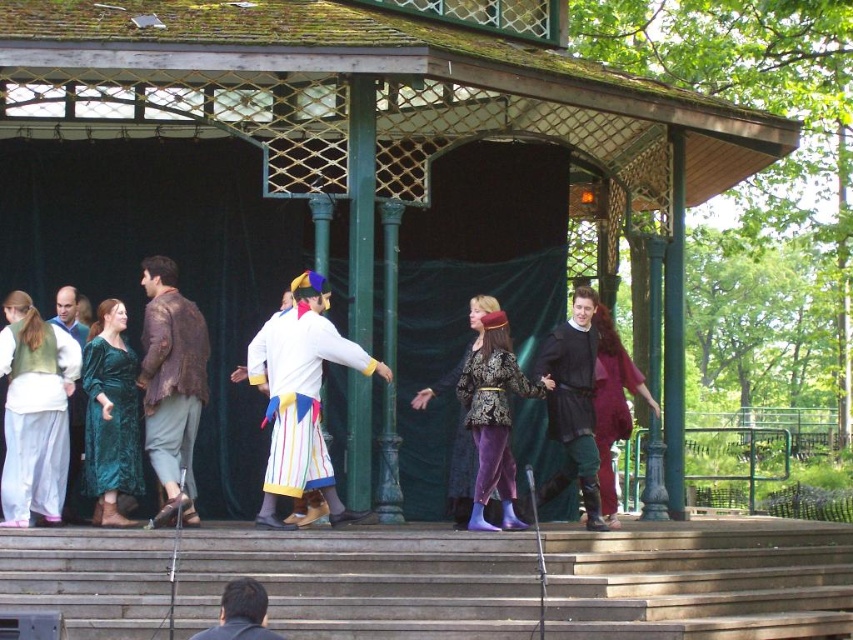
Question: Observing the image, what is the correct spatial positioning of white striped skirt at center in reference to white cotton shirt at left?

Choices:
 (A) below
 (B) above

Answer: (A)

Question: Which of the following is the farthest from the observer?

Choices:
 (A) (78, 339)
 (B) (631, 365)
 (C) (433, 563)

Answer: (B)

Question: Which point appears closest to the camera in this image?

Choices:
 (A) (573, 424)
 (B) (88, 440)
 (C) (68, 468)
 (D) (358, 365)

Answer: (D)

Question: Does dark brown leather boots at center appear over white cotton shirt at left?

Choices:
 (A) no
 (B) yes

Answer: (A)

Question: Estimate the real-world distances between objects in this image. Which object is farther from the velvet green vest at left?

Choices:
 (A) velvet/black brocade dress at center
 (B) dark brown leather jacket at lower center

Answer: (B)

Question: Does brown textured jacket at center have a greater width compared to white striped skirt at center?

Choices:
 (A) yes
 (B) no

Answer: (B)